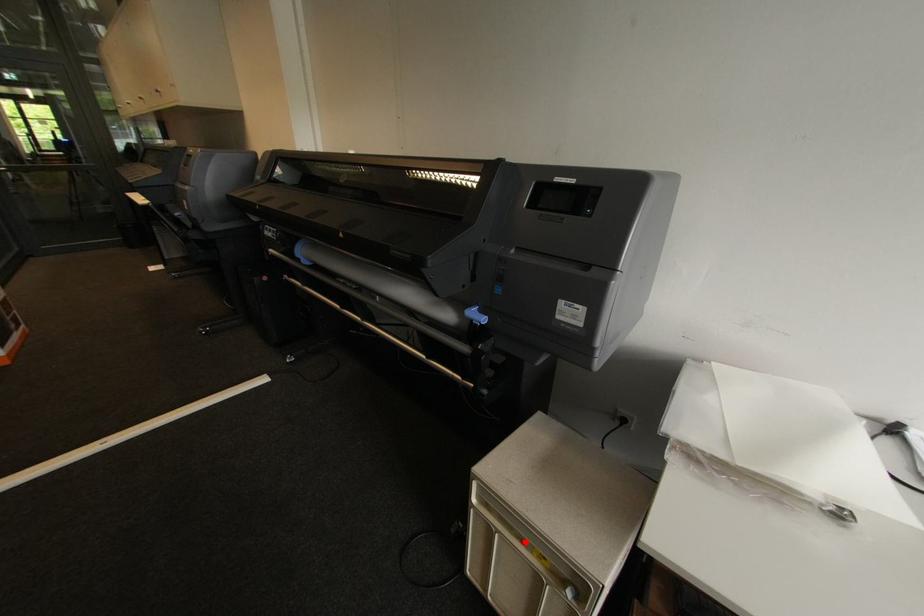
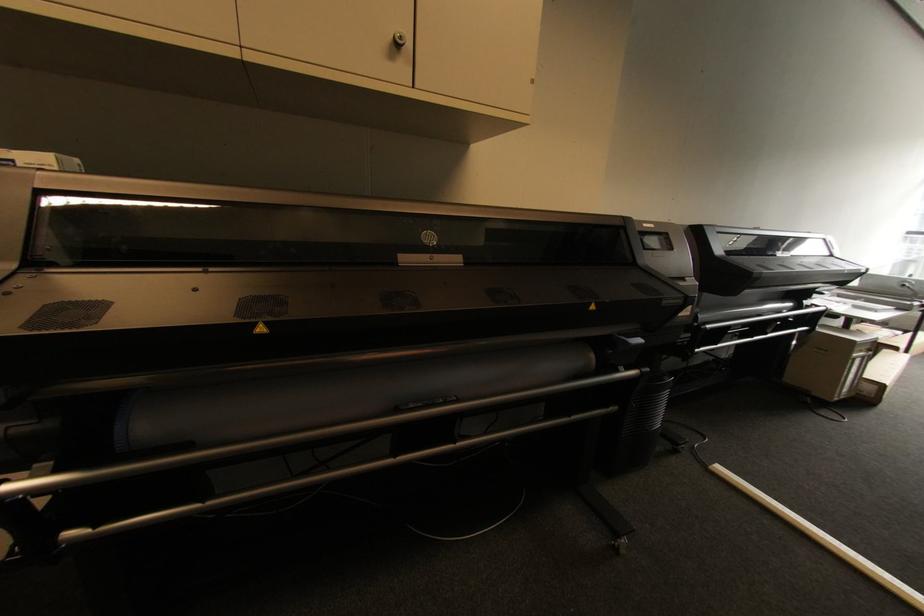
Question: I am providing you with two images of the same scene from different viewpoints. Given a red point in image1, look at the same physical point in image2. Is it:

Choices:
 (A) Closer to the viewpoint
 (B) Farther from the viewpoint

Answer: (A)